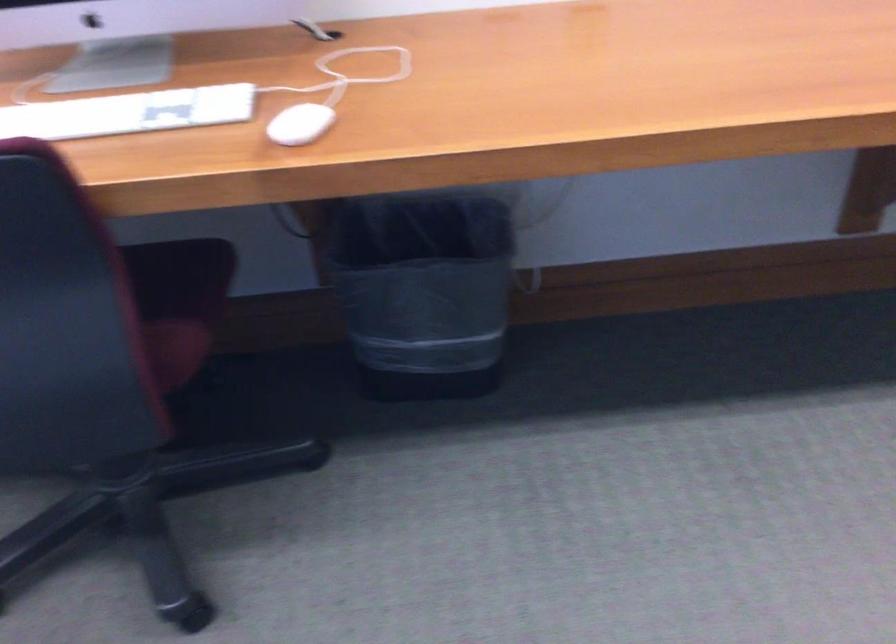
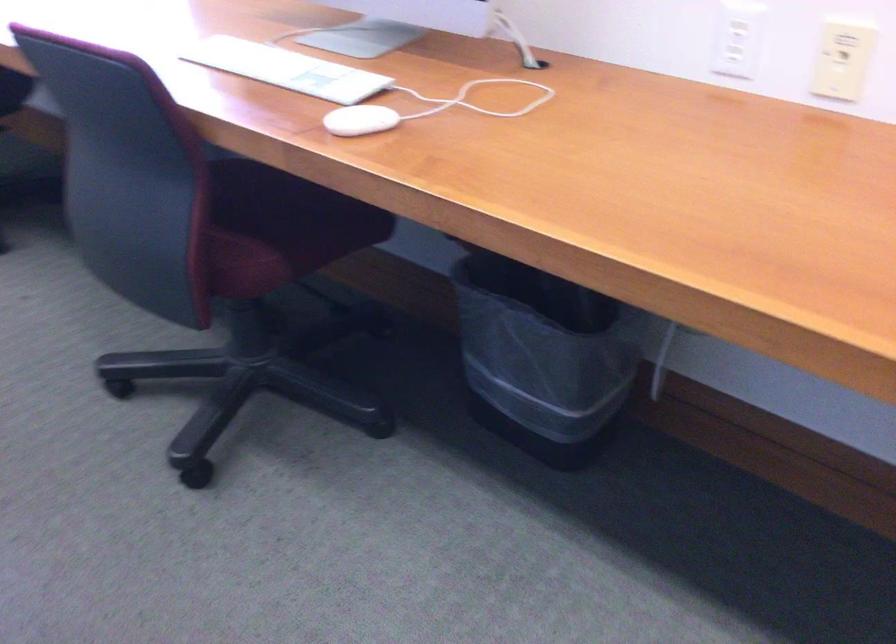
Question: The images are taken continuously from a first-person perspective. In which direction is your viewpoint rotating?

Choices:
 (A) Left
 (B) Right
 (C) Up
 (D) Down

Answer: (A)